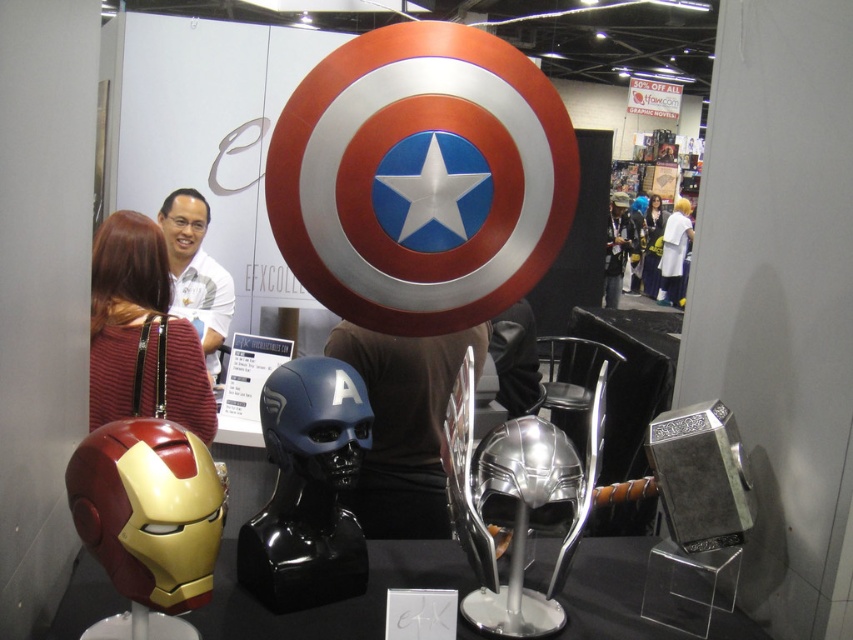
Question: Is glossy blue helmet at center positioned behind silver metallic helmet at center?

Choices:
 (A) no
 (B) yes

Answer: (B)

Question: Which object is farther from the camera taking this photo?

Choices:
 (A) maroon striped sweater at left
 (B) silky black hair at upper center
 (C) white matte shirt at upper center
 (D) glossy blue helmet at center

Answer: (B)

Question: Based on their relative distances, which object is farther from the white fabric shirt at upper center?

Choices:
 (A) maroon striped sweater at left
 (B) white matte shirt at upper center

Answer: (A)

Question: Observing the image, what is the correct spatial positioning of silver metallic helmet at center in reference to maroon striped sweater at left?

Choices:
 (A) left
 (B) right

Answer: (B)

Question: Which point is closer to the camera taking this photo?

Choices:
 (A) (670, 252)
 (B) (537, 595)
 (C) (338, 442)
 (D) (96, 276)

Answer: (C)

Question: Is glossy blue helmet at center above silky black hair at upper center?

Choices:
 (A) yes
 (B) no

Answer: (B)